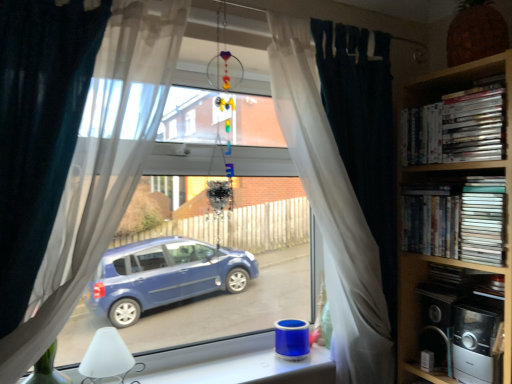
Find the location of a particular element. This screenshot has width=512, height=384. blank space above transparent glass window at lower center (from a real-world perspective) is located at coordinates (248, 361).